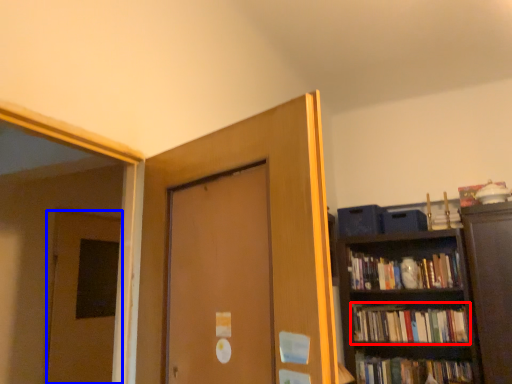
Question: Which point is further to the camera, book (highlighted by a red box) or door (highlighted by a blue box)?

Choices:
 (A) book
 (B) door

Answer: (A)